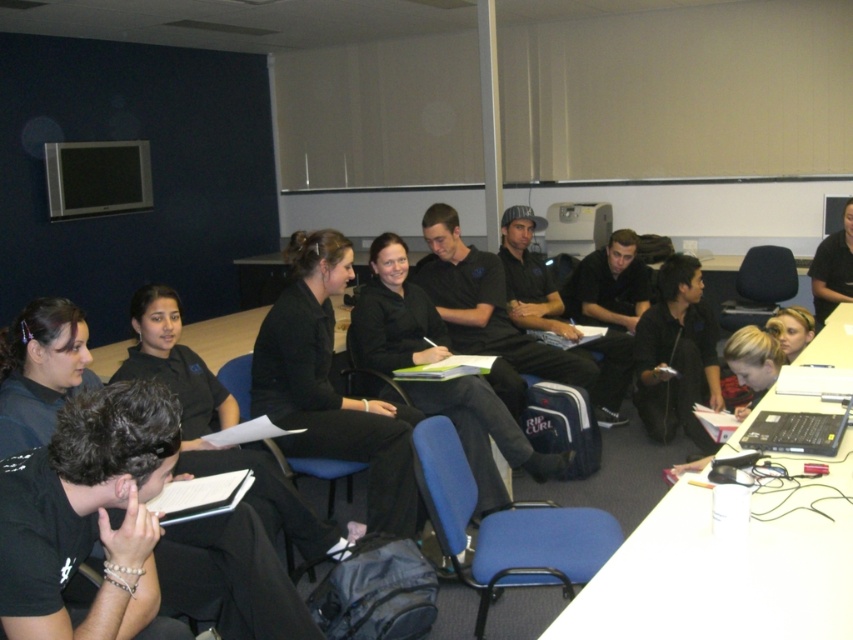
You are standing in the classroom and need to reach both the point at coordinates (x=352, y=321) and the point at (x=814, y=305). Which point should you approach first to minimize the distance walked?

You should approach point (x=352, y=321) first because it is closer to you than point (x=814, y=305), so reaching it first would require less walking distance.